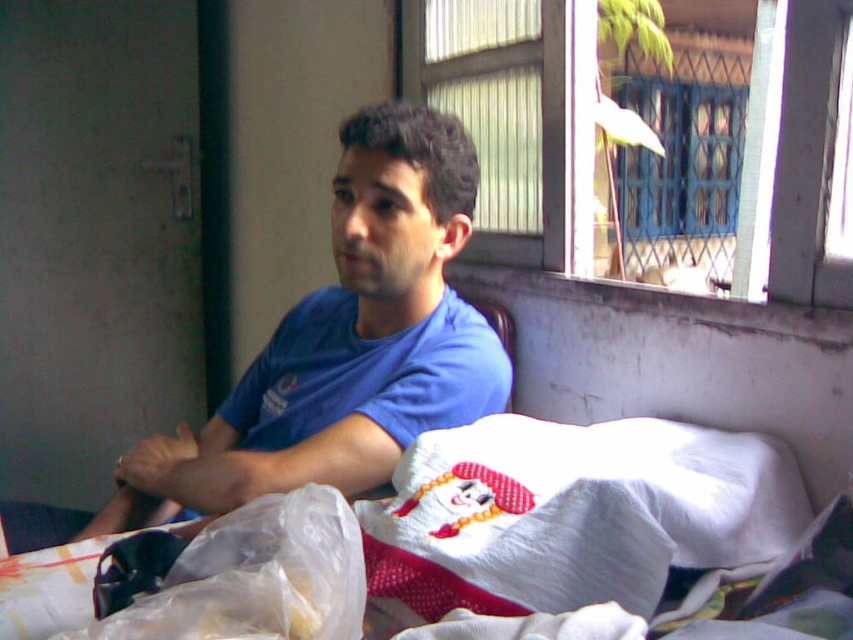
You are a delivery person who needs to place a small package on the floor between the blue cotton shirt at center and the white cotton bed at center. The package is 10 inches long. Can you fit it entirely between them without overlapping either object?

The blue cotton shirt at center is 12.15 inches away from the white cotton bed at center. Since the package is only 10 inches long, it can fit entirely between them without overlapping either object.

You are standing in the room shown in the image. You want to place a small lamp on the white cotton bed at center. Can you estimate the 2D coordinates where the lamp should be placed?

The 2D coordinates for placing the lamp on the white cotton bed at center would be approximately at point (589, 518).